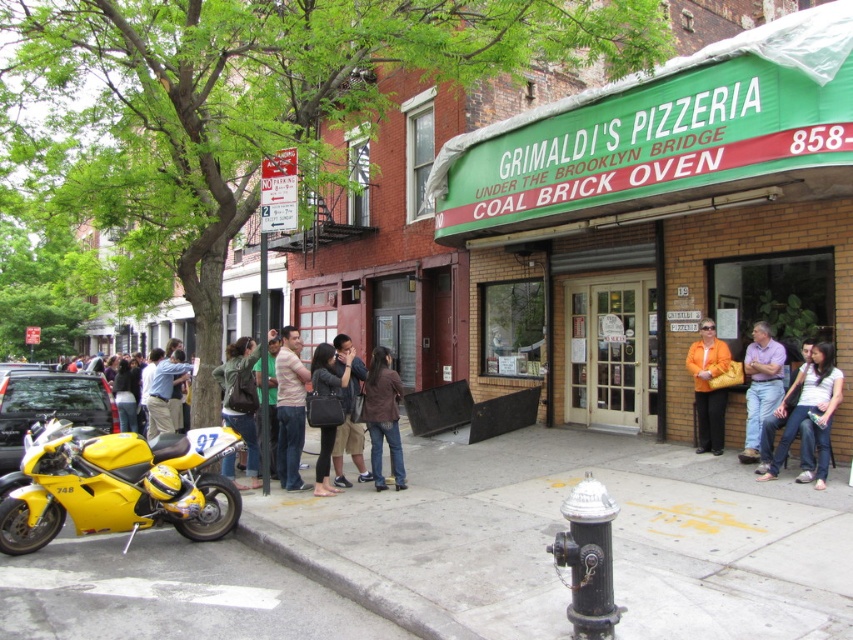
You are standing at the entrance of Grimaldi Pizzeria and see two points marked on the sidewalk. One is at coordinate point (399,470) and the other is at coordinate point (149,355). Which point is closer to you?

Point (399,470) is closer to the viewer than point (149,355).

You are standing at the entrance of Grimaldi Pizzeria. You see a point at coordinate (170, 369). What object is located at that point?

The point at coordinate (170, 369) is located on the light brown leather jacket at center.